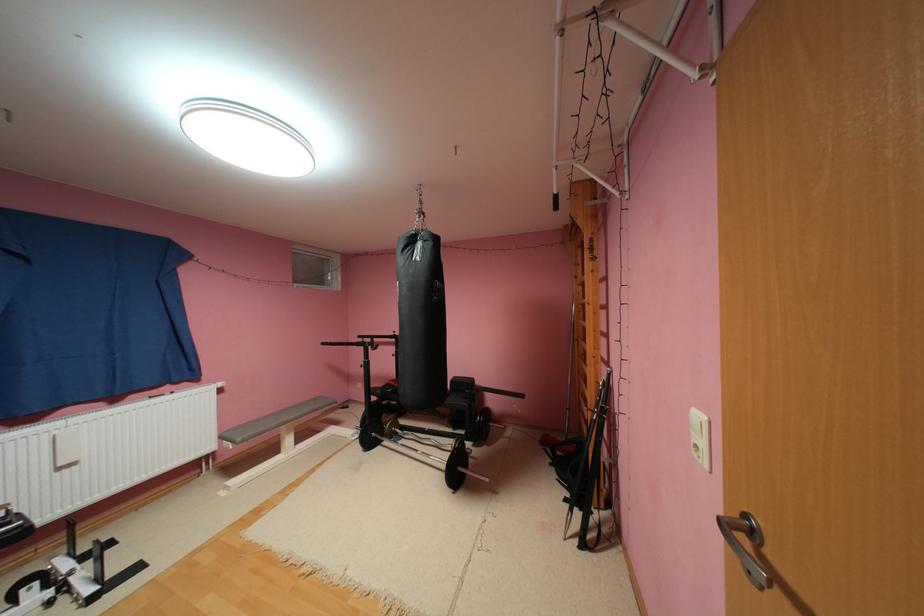
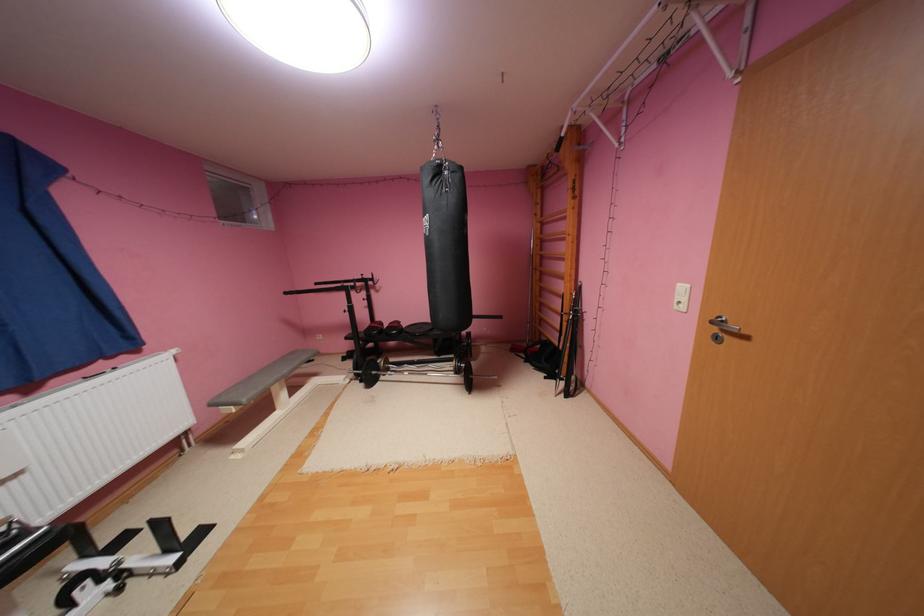
Where in the second image is the point corresponding to (x=68, y=469) from the first image?

(11, 483)